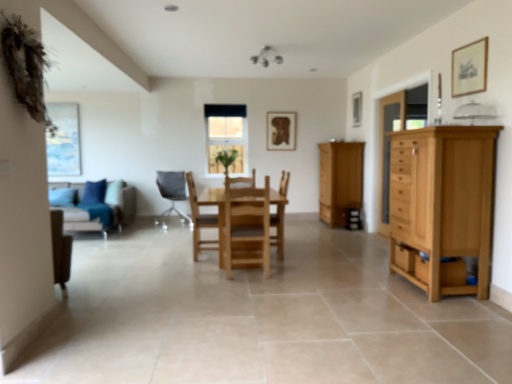
Question: Is green leafy plant at center at the left side of light brown wood cabinet at center right?

Choices:
 (A) no
 (B) yes

Answer: (B)

Question: Considering the relative sizes of green leafy plant at center and light brown wood cabinet at center right in the image provided, is green leafy plant at center smaller than light brown wood cabinet at center right?

Choices:
 (A) no
 (B) yes

Answer: (B)

Question: Is green leafy plant at center facing towards light brown wood cabinet at center right?

Choices:
 (A) yes
 (B) no

Answer: (B)

Question: From the image's perspective, does green leafy plant at center appear higher than light brown wood cabinet at center right?

Choices:
 (A) no
 (B) yes

Answer: (B)

Question: Is green leafy plant at center taller than light brown wood cabinet at center right?

Choices:
 (A) no
 (B) yes

Answer: (A)

Question: In terms of height, does light brown wooden cupboard at right look taller or shorter compared to light brown wooden table at center?

Choices:
 (A) tall
 (B) short

Answer: (A)

Question: Is light brown wooden cupboard at right to the left or to the right of light brown wooden table at center in the image?

Choices:
 (A) right
 (B) left

Answer: (A)

Question: Considering the positions of light brown wooden cupboard at right and light brown wooden table at center in the image, is light brown wooden cupboard at right bigger or smaller than light brown wooden table at center?

Choices:
 (A) small
 (B) big

Answer: (A)

Question: From a real-world perspective, is light brown wooden cupboard at right physically located above or below light brown wooden table at center?

Choices:
 (A) below
 (B) above

Answer: (B)

Question: From the image's perspective, relative to natural wood chair at center, the third chair when ordered from left to right, is matte gray chair at center, arranged as the 3th chair when viewed from the front, above or below?

Choices:
 (A) below
 (B) above

Answer: (B)

Question: In the image, is matte gray chair at center, marked as the first chair in a back-to-front arrangement, on the left side or the right side of natural wood chair at center, which appears as the third chair when viewed from the back?

Choices:
 (A) right
 (B) left

Answer: (B)

Question: Is point (182, 172) positioned closer to the camera than point (257, 216)?

Choices:
 (A) closer
 (B) farther

Answer: (B)

Question: Is matte gray chair at center, arranged as the 3th chair when viewed from the front, bigger or smaller than natural wood chair at center, the third chair when ordered from left to right?

Choices:
 (A) big
 (B) small

Answer: (A)

Question: Looking at their shapes, would you say wooden picture frame at upper right, arranged as the third picture frame when viewed from the left, is wider or thinner than light brown wooden cupboard at right?

Choices:
 (A) wide
 (B) thin

Answer: (B)

Question: Is wooden picture frame at upper right, arranged as the third picture frame when viewed from the left, in front of or behind light brown wooden cupboard at right in the image?

Choices:
 (A) front
 (B) behind

Answer: (B)